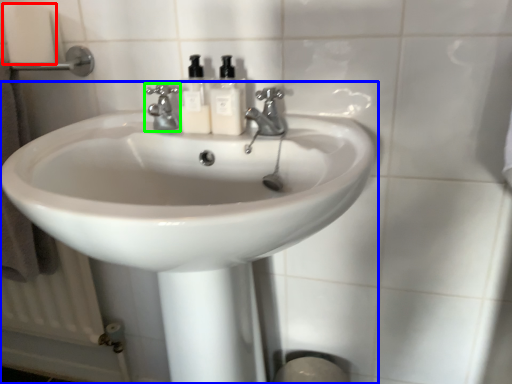
Question: Which object is positioned farthest from toilet paper (highlighted by a red box)? Select from sink (highlighted by a blue box) and tap (highlighted by a green box).

Choices:
 (A) sink
 (B) tap

Answer: (A)